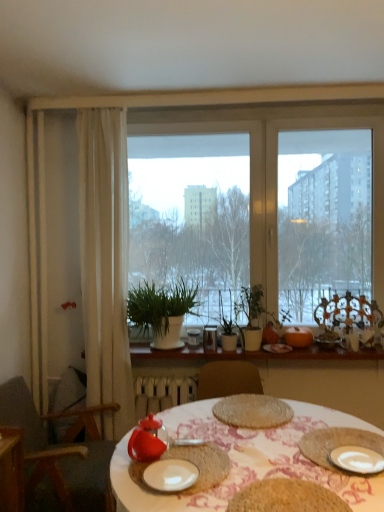
You are a GUI agent. You are given a task and a screenshot of the screen. Output one action in this format:
    pyautogui.click(x=<x>, y=<y>)
    Task: Click on the vacant space to the right of white matte plate at center, which ranks as the 2th plate in right-to-left order
    The height and width of the screenshot is (512, 384).
    Given the screenshot: What is the action you would take?
    pyautogui.click(x=229, y=476)